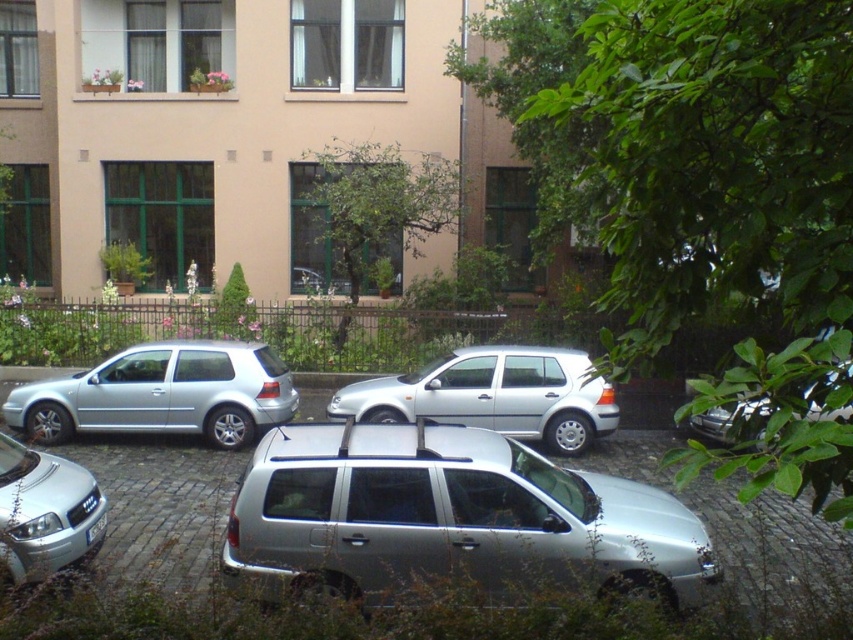
Who is lower down, silver metallic hatchback at center-left or silver metallic hatchback at center?

silver metallic hatchback at center-left

Does silver metallic hatchback at center-left appear on the right side of silver metallic hatchback at center?

In fact, silver metallic hatchback at center-left is to the left of silver metallic hatchback at center.

Describe the element at coordinates (161, 394) in the screenshot. I see `silver metallic hatchback at center-left` at that location.

The image size is (853, 640). In order to click on silver metallic hatchback at center-left in this screenshot , I will do `click(161, 394)`.

Is silver metallic hatchback at center-left above metallic silver car at right?

Incorrect, silver metallic hatchback at center-left is not positioned above metallic silver car at right.

Is silver metallic hatchback at center-left closer to camera compared to metallic silver car at right?

No, it is not.

This screenshot has height=640, width=853. I want to click on silver metallic hatchback at center-left, so click(161, 394).

Is silver metallic hatchback at center shorter than metallic silver car at right?

Incorrect, silver metallic hatchback at center's height does not fall short of metallic silver car at right's.

Can you confirm if silver metallic hatchback at center is positioned to the right of metallic silver car at right?

In fact, silver metallic hatchback at center is to the left of metallic silver car at right.

The image size is (853, 640). I want to click on silver metallic hatchback at center, so click(x=492, y=396).